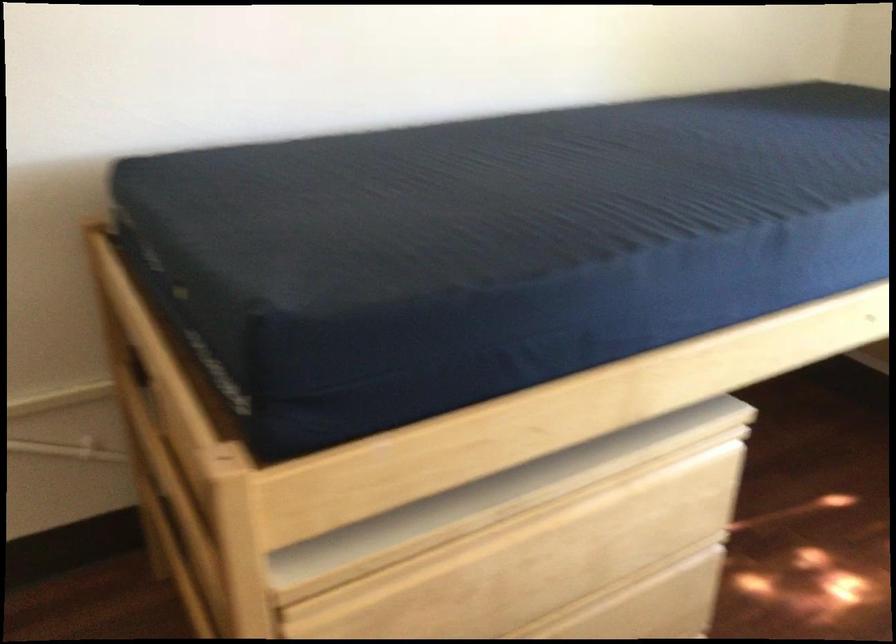
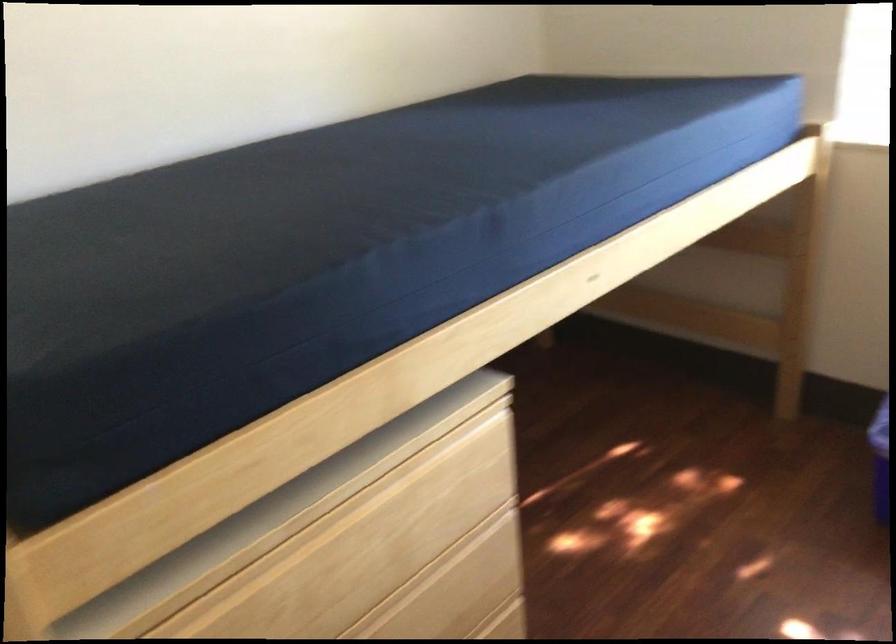
In the second image, find the point that corresponds to (x=380, y=574) in the first image.

(186, 611)